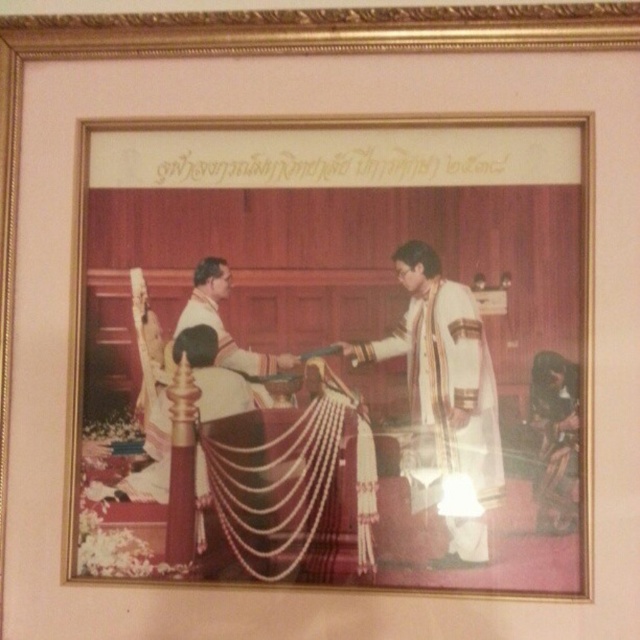
Is white silk dhoti at center below white silk robe at center?

Yes, white silk dhoti at center is below white silk robe at center.

Can you confirm if white silk dhoti at center is bigger than white silk robe at center?

Indeed, white silk dhoti at center has a larger size compared to white silk robe at center.

Identify the location of white silk dhoti at center. (444, 401).

The image size is (640, 640). I want to click on white silk dhoti at center, so pos(444,401).

Which of these two, matte gold picture frame at center or white silk dhoti at center, stands shorter?

white silk dhoti at center

Does matte gold picture frame at center have a greater width compared to white silk dhoti at center?

Indeed, matte gold picture frame at center has a greater width compared to white silk dhoti at center.

Is point (426, 301) behind point (400, 280)?

No, it is not.

Locate an element on the screen. The image size is (640, 640). matte gold picture frame at center is located at coordinates (333, 353).

Is matte gold picture frame at center thinner than white silk robe at center?

Incorrect, matte gold picture frame at center's width is not less than white silk robe at center's.

Who is shorter, matte gold picture frame at center or white silk robe at center?

white silk robe at center

Find the location of a particular element. matte gold picture frame at center is located at coordinates (333, 353).

The width and height of the screenshot is (640, 640). Find the location of `matte gold picture frame at center`. matte gold picture frame at center is located at coordinates (333, 353).